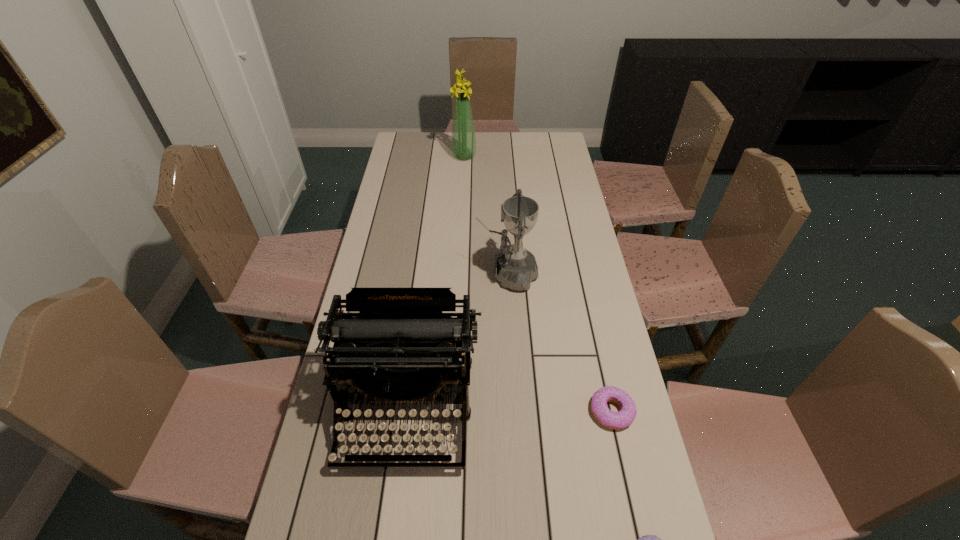
Identify the location of free space between the typewriter and the farthest object. (436, 283).

This screenshot has height=540, width=960. Identify the location of object that can be found as the third closest to the typewriter. (647, 539).

Select which object is the closest to the shortest object. Please provide its 2D coordinates. Your answer should be formatted as a tuple, i.e. [(x, y)], where the tuple contains the x and y coordinates of a point satisfying the conditions above.

[(614, 420)]

I want to click on vacant area that satisfies the following two spatial constraints: 1. on the front-facing side of the tallest object; 2. on the back side of the farther doughnut, so click(x=452, y=411).

The image size is (960, 540). I want to click on vacant point that satisfies the following two spatial constraints: 1. on the typing side of the typewriter; 2. on the left side of the taller doughnut, so click(408, 411).

This screenshot has height=540, width=960. What are the coordinates of `free spot that satisfies the following two spatial constraints: 1. on the side with emblem of the award; 2. on the typing side of the typewriter` in the screenshot? It's located at (515, 410).

Where is `free location that satisfies the following two spatial constraints: 1. on the front-facing side of the bouquet; 2. on the back side of the taller doughnut`? The height and width of the screenshot is (540, 960). free location that satisfies the following two spatial constraints: 1. on the front-facing side of the bouquet; 2. on the back side of the taller doughnut is located at coordinates (452, 411).

You are a GUI agent. You are given a task and a screenshot of the screen. Output one action in this format:
    pyautogui.click(x=<x>, y=<y>)
    Task: Click on the free space that satisfies the following two spatial constraints: 1. on the front-facing side of the tallest object; 2. on the typing side of the typewriter
    
    Given the screenshot: What is the action you would take?
    pyautogui.click(x=452, y=410)

Locate an element on the screen. vacant region that satisfies the following two spatial constraints: 1. on the front-facing side of the farthest object; 2. on the typing side of the typewriter is located at coordinates (452, 410).